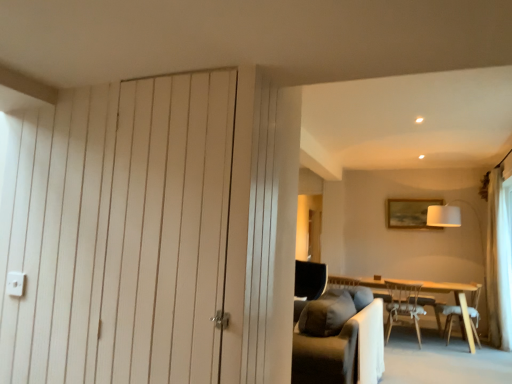
Question: Would you say white fabric lampshade at upper right is a long distance from wooden framed picture at upper right?

Choices:
 (A) yes
 (B) no

Answer: (B)

Question: Would you say white fabric lampshade at upper right is outside wooden framed picture at upper right?

Choices:
 (A) yes
 (B) no

Answer: (A)

Question: Does white fabric lampshade at upper right have a smaller size compared to wooden framed picture at upper right?

Choices:
 (A) yes
 (B) no

Answer: (B)

Question: Is white fabric lampshade at upper right behind wooden framed picture at upper right?

Choices:
 (A) yes
 (B) no

Answer: (B)

Question: Can you confirm if white fabric lampshade at upper right is positioned to the left of wooden framed picture at upper right?

Choices:
 (A) no
 (B) yes

Answer: (A)

Question: Considering the relative sizes of white fabric lampshade at upper right and wooden framed picture at upper right in the image provided, is white fabric lampshade at upper right thinner than wooden framed picture at upper right?

Choices:
 (A) yes
 (B) no

Answer: (B)

Question: From a real-world perspective, is wooden chair at lower right, which is counted as the second chair, starting from the left, over light wood table at center?

Choices:
 (A) no
 (B) yes

Answer: (B)

Question: Can you confirm if wooden chair at lower right, marked as the first chair in a right-to-left arrangement, is bigger than light wood table at center?

Choices:
 (A) yes
 (B) no

Answer: (B)

Question: Is wooden chair at lower right, marked as the first chair in a right-to-left arrangement, oriented towards light wood table at center?

Choices:
 (A) no
 (B) yes

Answer: (B)

Question: Could light wood table at center be considered to be inside wooden chair at lower right, marked as the first chair in a right-to-left arrangement?

Choices:
 (A) yes
 (B) no

Answer: (B)

Question: Is light wood table at center at the back of wooden chair at lower right, which is counted as the second chair, starting from the left?

Choices:
 (A) no
 (B) yes

Answer: (B)

Question: Does wooden chair at lower right, which is counted as the second chair, starting from the left, have a greater height compared to light wood table at center?

Choices:
 (A) yes
 (B) no

Answer: (A)

Question: Does light wood table at center touch white fabric lampshade at upper right?

Choices:
 (A) yes
 (B) no

Answer: (B)